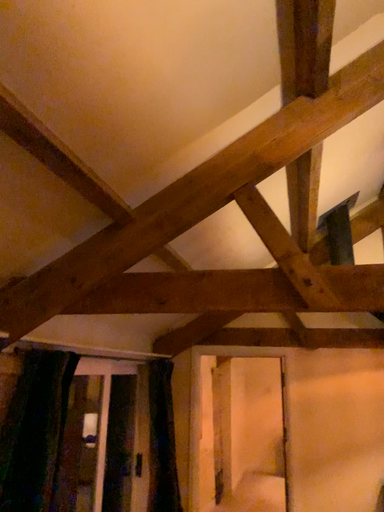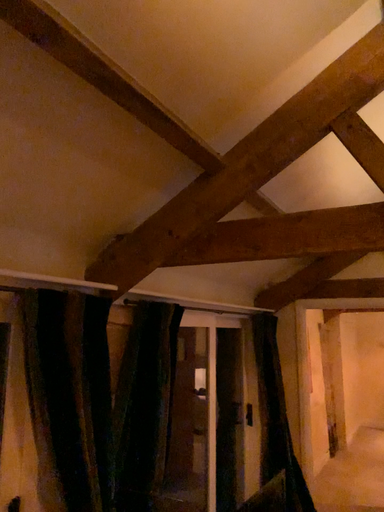
Question: Which way did the camera rotate in the video?

Choices:
 (A) rotated right
 (B) rotated left

Answer: (B)